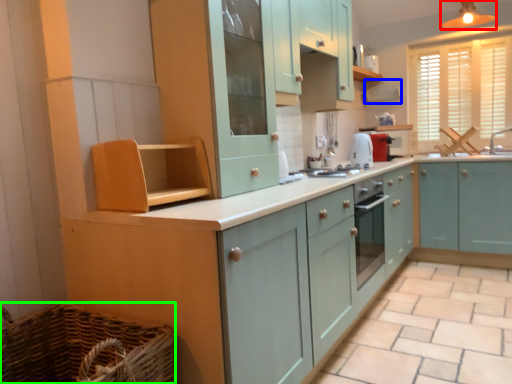
Question: Which object is positioned farthest from light fixture (highlighted by a red box)? Select from exhaust hood (highlighted by a blue box) and basket (highlighted by a green box).

Choices:
 (A) exhaust hood
 (B) basket

Answer: (B)